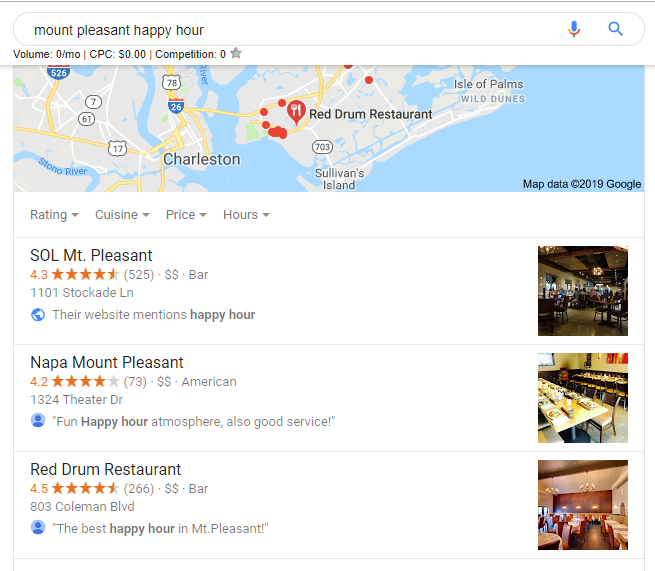
The width and height of the screenshot is (655, 571). In order to click on chair in this screenshot , I will do `click(614, 311)`.